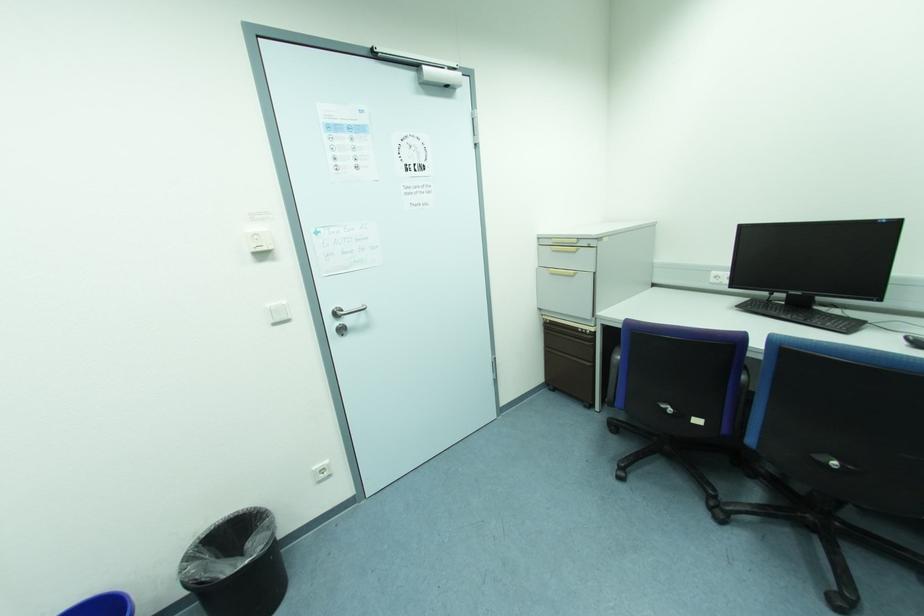
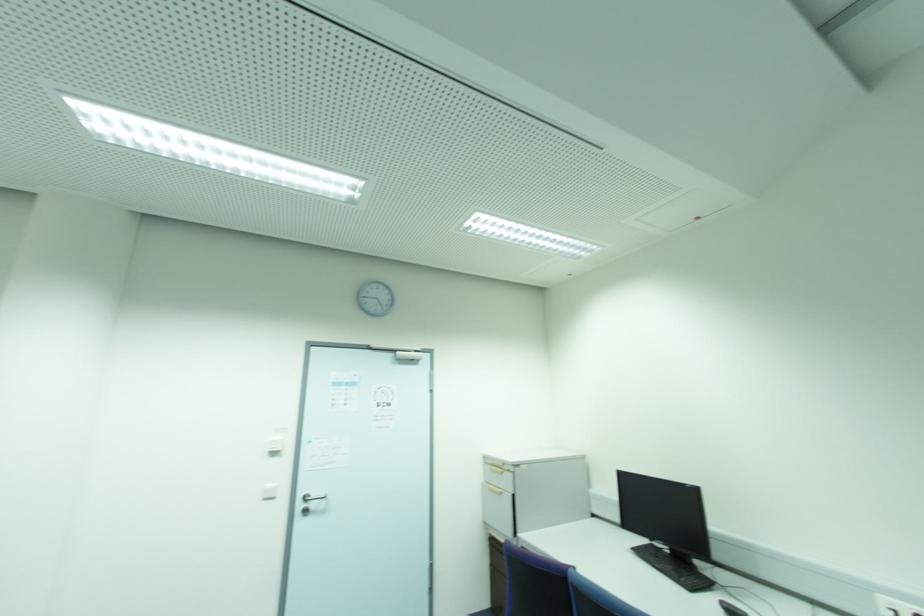
In the second image, find the point that corresponds to pixel 578 251 in the first image.

(503, 472)